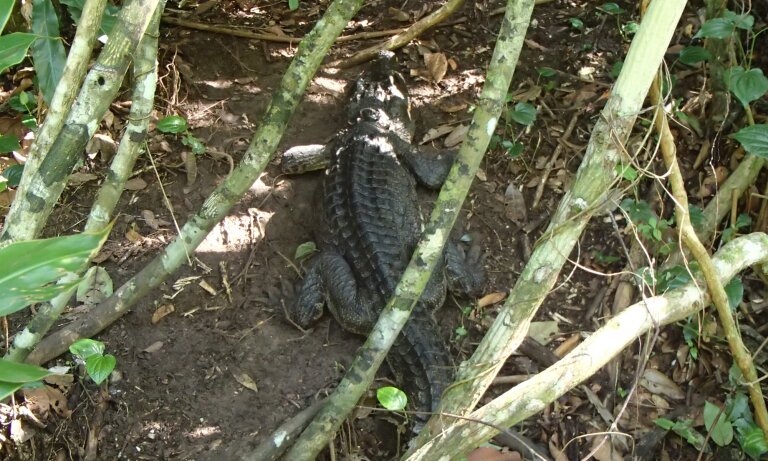
Locate an element on the screen. The image size is (768, 461). the left front leg is located at coordinates (296, 154).